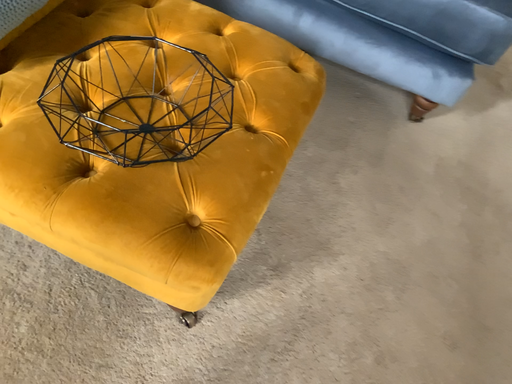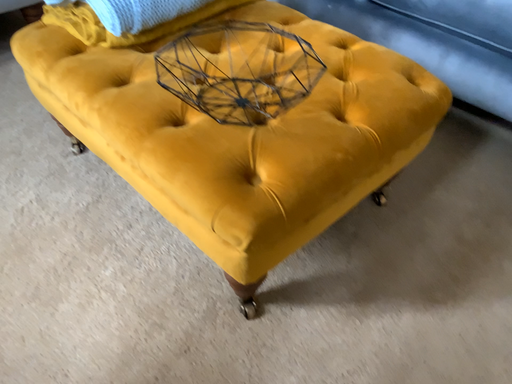
Question: Which way did the camera rotate in the video?

Choices:
 (A) rotated left
 (B) rotated right

Answer: (A)